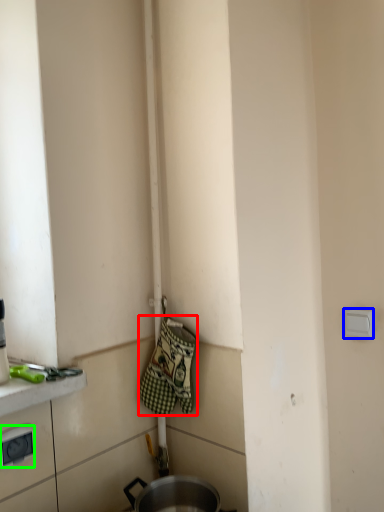
Question: Considering the real-world distances, which object is closest to blanket (highlighted by a red box)? electric outlet (highlighted by a blue box) or electric outlet (highlighted by a green box).

Choices:
 (A) electric outlet
 (B) electric outlet

Answer: (B)